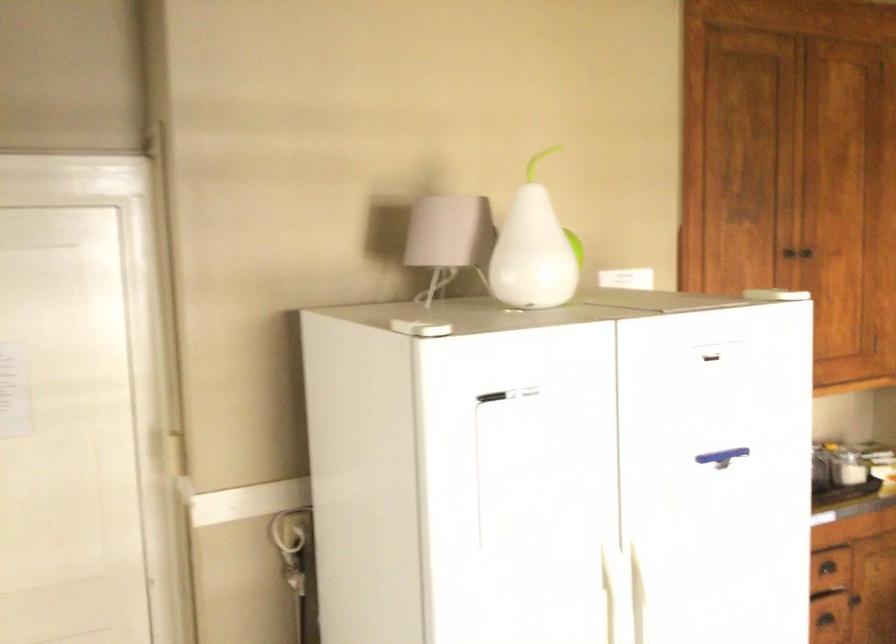
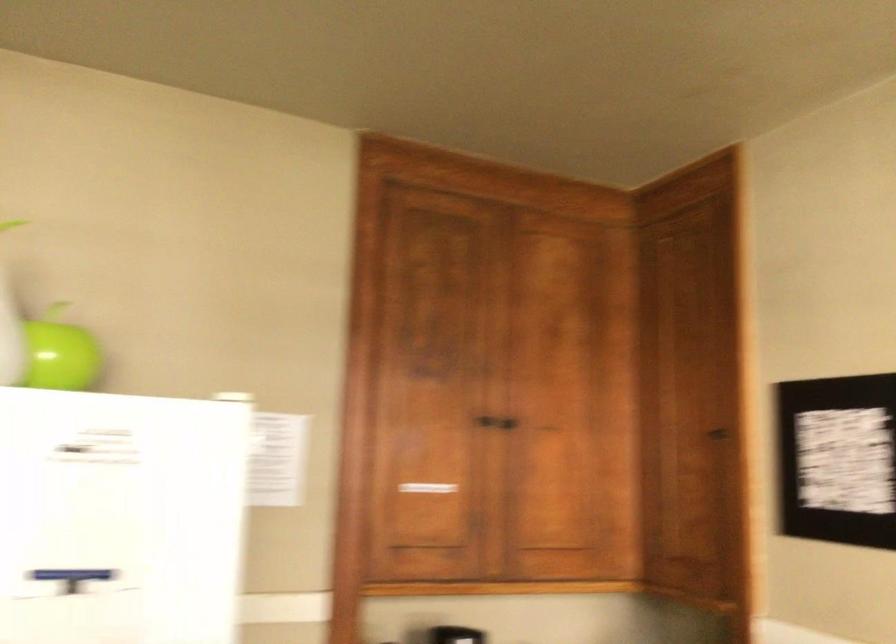
In the second image, find the point that corresponds to point 799,257 in the first image.

(485, 420)